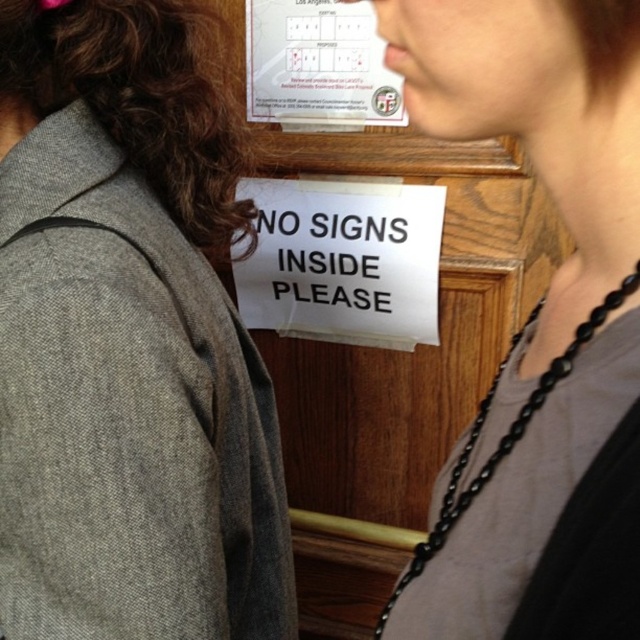
You are a security guard checking the door. You notice the gray woolen jacket at left and the brown curly hair at upper left. Which object is closer to you?

The gray woolen jacket at left is closer to the viewer than brown curly hair at upper left.

You are standing in front of the wooden door and need to locate the matte black necklace at upper right and the white paper poster at upper center. Which object is positioned more to the right side?

The matte black necklace at upper right is positioned to the right of the white paper poster at upper center, so it is more to the right side.